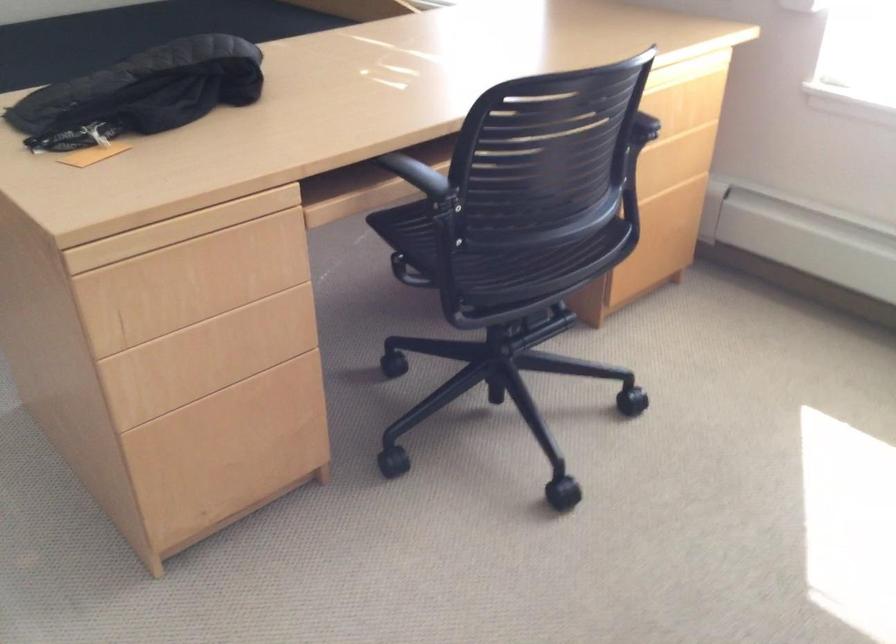
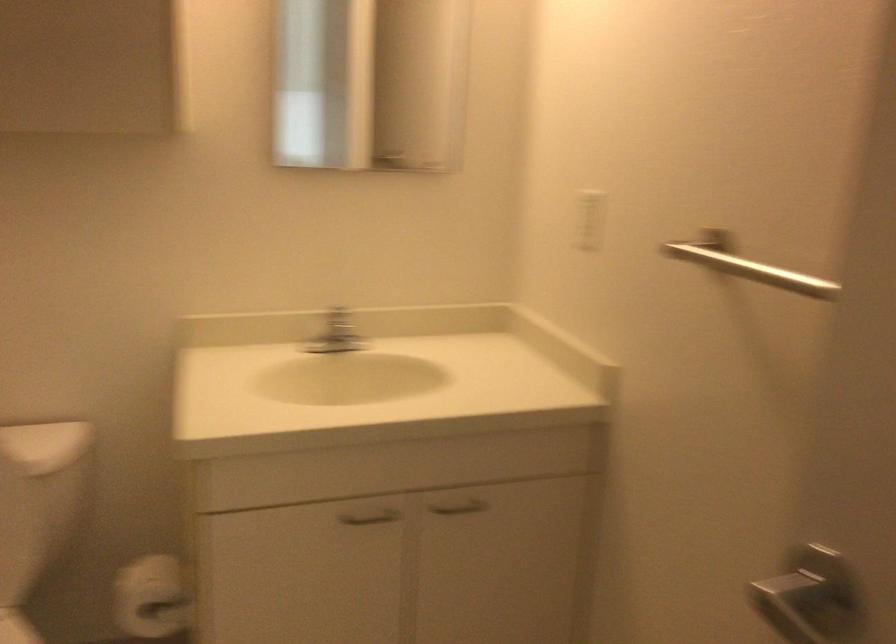
Question: The images are taken continuously from a first-person perspective. In which direction are you moving?

Choices:
 (A) Left
 (B) Right
 (C) Forward
 (D) Backward

Answer: (A)